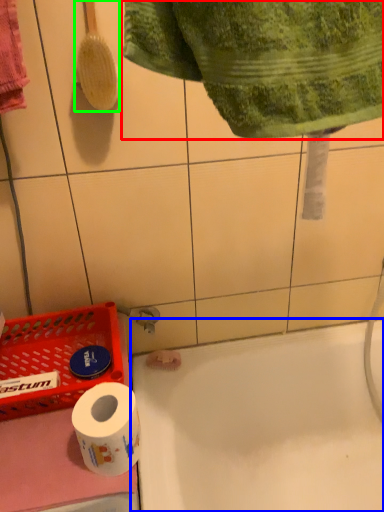
Question: Based on their relative distances, which object is nearer to towel (highlighted by a red box)? Choose from bath (highlighted by a blue box) and brush (highlighted by a green box).

Choices:
 (A) bath
 (B) brush

Answer: (B)